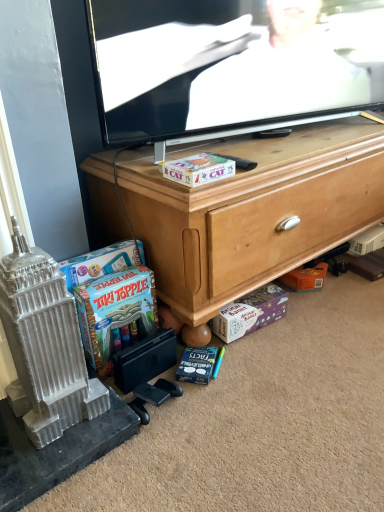
Question: Is blue matte book at lower center in front of flat screen tv at upper center?

Choices:
 (A) yes
 (B) no

Answer: (B)

Question: Is blue matte book at lower center in contact with flat screen tv at upper center?

Choices:
 (A) no
 (B) yes

Answer: (A)

Question: From a real-world perspective, does blue matte book at lower center sit lower than flat screen tv at upper center?

Choices:
 (A) no
 (B) yes

Answer: (B)

Question: Does blue matte book at lower center have a smaller size compared to flat screen tv at upper center?

Choices:
 (A) no
 (B) yes

Answer: (B)

Question: Does blue matte book at lower center appear on the left side of flat screen tv at upper center?

Choices:
 (A) yes
 (B) no

Answer: (A)

Question: Can you confirm if blue matte book at lower center is shorter than flat screen tv at upper center?

Choices:
 (A) yes
 (B) no

Answer: (A)

Question: Is matte cardboard box at center, which appears as the 2th cash when viewed from the right, surrounding purple cardboard box at lower center, which is the first cash from bottom to top?

Choices:
 (A) yes
 (B) no

Answer: (B)

Question: From a real-world perspective, is matte cardboard box at center, which is counted as the 3th cash, starting from the bottom, positioned under purple cardboard box at lower center, which is the first cash from bottom to top, based on gravity?

Choices:
 (A) yes
 (B) no

Answer: (B)

Question: From a real-world perspective, is matte cardboard box at center, which is counted as the 3th cash, starting from the bottom, over purple cardboard box at lower center, which is the first cash from bottom to top?

Choices:
 (A) no
 (B) yes

Answer: (B)

Question: Does matte cardboard box at center, which is counted as the 3th cash, starting from the bottom, appear on the right side of purple cardboard box at lower center, which is the first cash from bottom to top?

Choices:
 (A) no
 (B) yes

Answer: (A)

Question: Can you confirm if matte cardboard box at center, which is counted as the 3th cash, starting from the bottom, is wider than purple cardboard box at lower center, acting as the third cash starting from the top?

Choices:
 (A) yes
 (B) no

Answer: (A)

Question: Is matte cardboard box at center, the first cash when ordered from top to bottom, smaller than purple cardboard box at lower center, which is the first cash from bottom to top?

Choices:
 (A) yes
 (B) no

Answer: (A)

Question: Does black plastic remote control at center have a greater width compared to matte cardboard box at center, which is counted as the 3th cash, starting from the bottom?

Choices:
 (A) no
 (B) yes

Answer: (B)